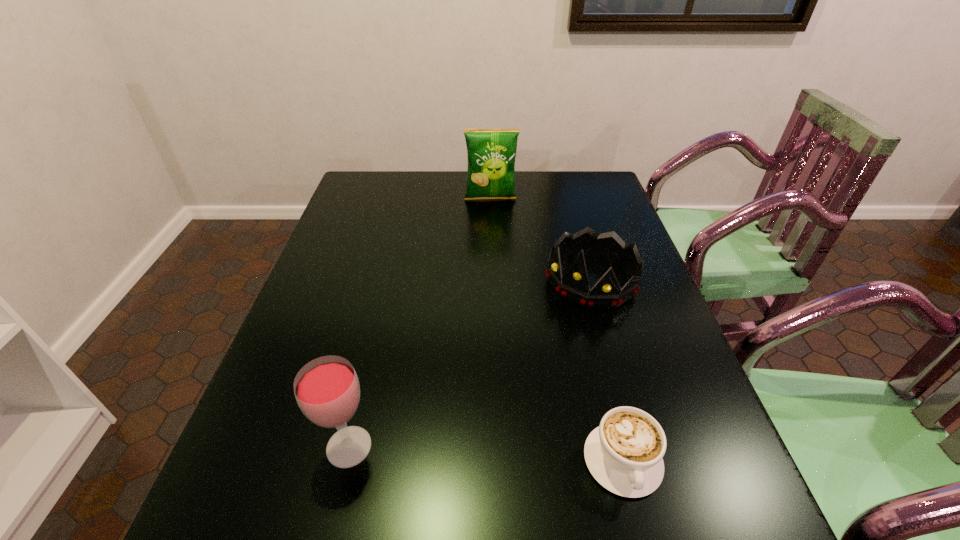
The width and height of the screenshot is (960, 540). I want to click on vacant space at the far edge of the desktop, so click(435, 174).

The width and height of the screenshot is (960, 540). I want to click on free space at the near edge of the desktop, so click(427, 447).

The width and height of the screenshot is (960, 540). Identify the location of free space at the left edge of the desktop. (342, 348).

The width and height of the screenshot is (960, 540). Identify the location of vacant space at the right edge of the desktop. (602, 313).

The height and width of the screenshot is (540, 960). I want to click on vacant region between the farthest object and the second shortest object, so click(x=540, y=240).

At what (x,y) coordinates should I click in order to perform the action: click on free space between the leftmost object and the crisp (potato chip). Please return your answer as a coordinate pair (x, y). This screenshot has width=960, height=540. Looking at the image, I should click on (420, 323).

At what (x,y) coordinates should I click in order to perform the action: click on free space between the second farthest object and the shortest object. Please return your answer as a coordinate pair (x, y). This screenshot has width=960, height=540. Looking at the image, I should click on (607, 371).

This screenshot has width=960, height=540. Identify the location of free area in between the third object from right to left and the cappuccino. (557, 330).

The height and width of the screenshot is (540, 960). I want to click on vacant space that is in between the second tallest object and the shortest object, so (486, 454).

I want to click on unoccupied position between the leftmost object and the cappuccino, so click(486, 454).